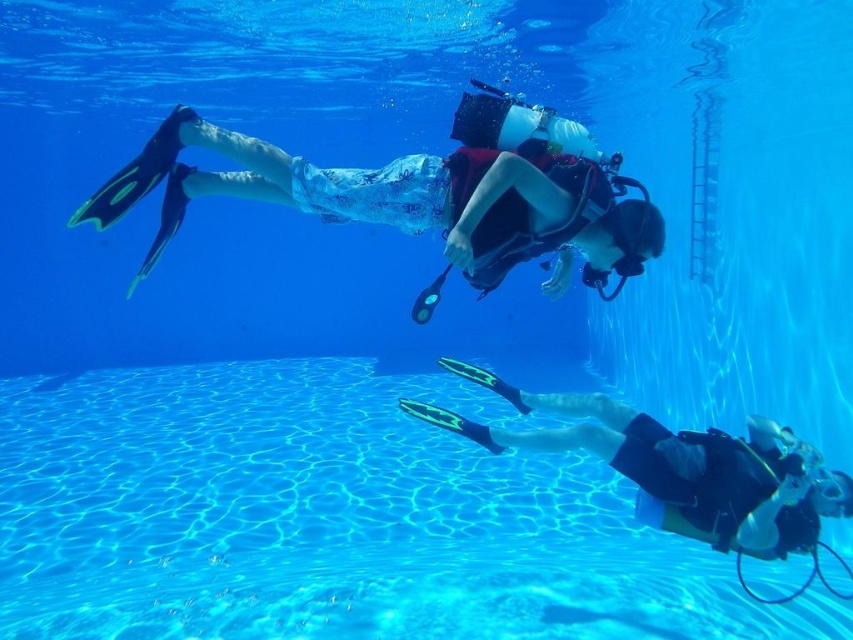
Question: Among these objects, which one is nearest to the camera?

Choices:
 (A) clear blue water at lower center
 (B) black matte fins at lower right

Answer: (A)

Question: Observing the image, what is the correct spatial positioning of clear blue water at lower center in reference to black matte fins at lower right?

Choices:
 (A) below
 (B) above

Answer: (A)

Question: Which point is farther to the camera?

Choices:
 (A) black matte fins at lower right
 (B) clear blue water at lower center

Answer: (A)

Question: Can you confirm if clear blue water at lower center is smaller than black matte fins at lower right?

Choices:
 (A) no
 (B) yes

Answer: (A)

Question: Which point is farther from the camera taking this photo?

Choices:
 (A) (3, 460)
 (B) (843, 500)

Answer: (A)

Question: From the image, what is the correct spatial relationship of clear blue water at lower center in relation to black matte fins at lower right?

Choices:
 (A) right
 (B) left

Answer: (B)